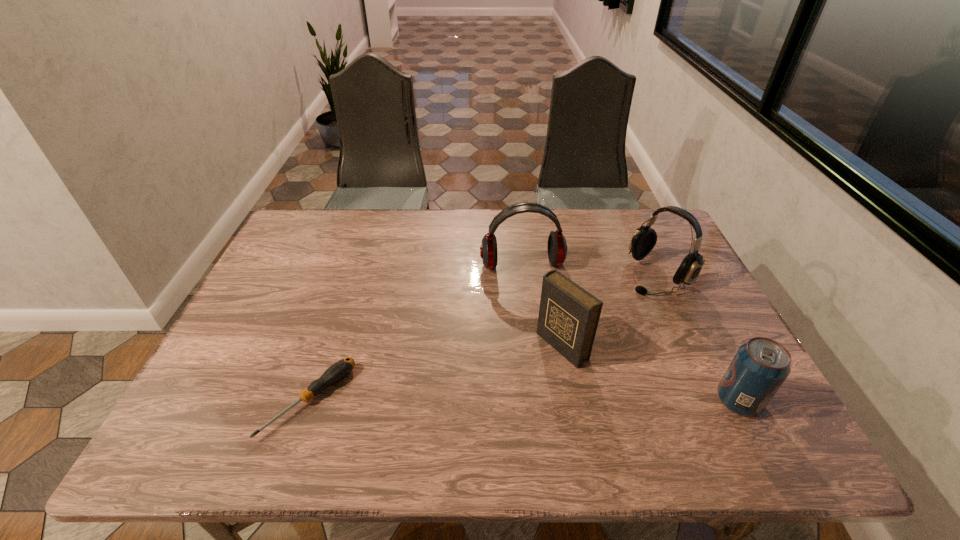
The height and width of the screenshot is (540, 960). I want to click on vacant spot on the desktop that is between the shortest object and the pop soda and is positioned on the ear cups of the earphone, so click(x=553, y=401).

Find the location of `vacant space on the desktop that is between the screwdriver and the pop soda and is positioned with the microphone on the side of the headset`. vacant space on the desktop that is between the screwdriver and the pop soda and is positioned with the microphone on the side of the headset is located at coordinates (465, 401).

At what (x,y) coordinates should I click in order to perform the action: click on free space on the desktop that is between the shortest object and the pop soda and is positioned on the front cover of the diary. Please return your answer as a coordinate pair (x, y). Looking at the image, I should click on (483, 401).